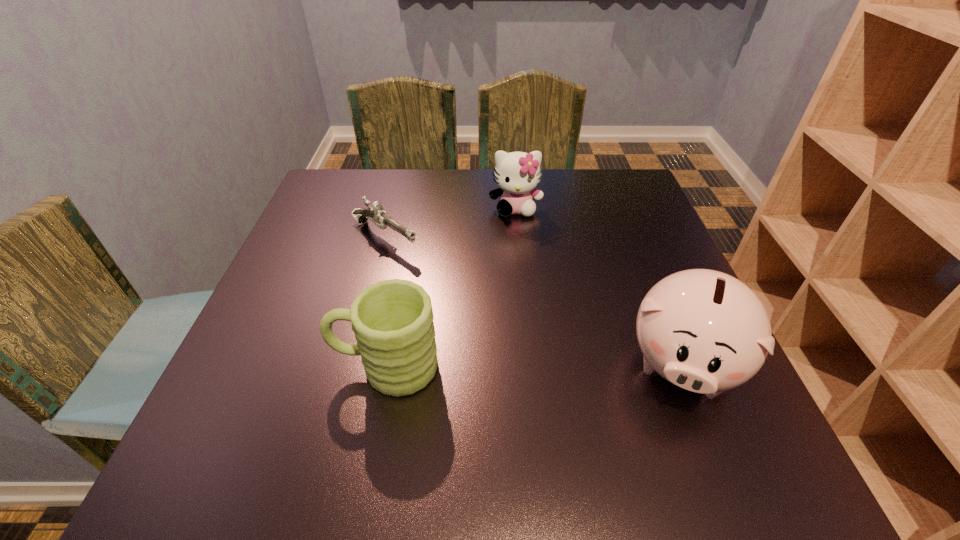
Where is `vacant spot on the desktop that is between the mug and the piggy bank and is positioned on the front-facing side of the kitten`? The width and height of the screenshot is (960, 540). vacant spot on the desktop that is between the mug and the piggy bank and is positioned on the front-facing side of the kitten is located at coordinates (528, 366).

This screenshot has width=960, height=540. I want to click on vacant spot on the desktop that is between the mug and the tallest object and is positioned aimed along the barrel of the shortest object, so click(574, 366).